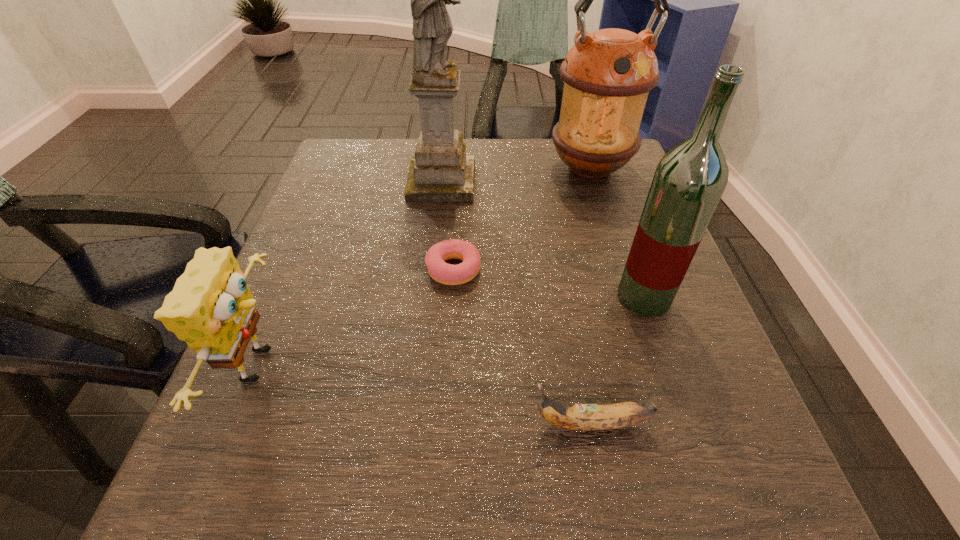
You are a GUI agent. You are given a task and a screenshot of the screen. Output one action in this format:
    pyautogui.click(x=<x>, y=<y>)
    Task: Click on the tallest object
    
    Given the screenshot: What is the action you would take?
    pyautogui.click(x=440, y=171)

This screenshot has height=540, width=960. I want to click on oil lamp, so click(607, 74).

In order to click on liquor in this screenshot , I will do `click(689, 180)`.

Where is `the leftmost object`? Image resolution: width=960 pixels, height=540 pixels. the leftmost object is located at coordinates (210, 307).

The image size is (960, 540). I want to click on sponge, so click(210, 307).

This screenshot has height=540, width=960. In order to click on the second shortest object in this screenshot , I will do `click(583, 417)`.

Locate an element on the screen. the shortest object is located at coordinates (442, 272).

This screenshot has height=540, width=960. Identify the location of free spot located 0.350m on the front-facing side of the sculpture. (627, 183).

The height and width of the screenshot is (540, 960). I want to click on vacant space located 0.070m on the front of the oil lamp, so click(604, 212).

Image resolution: width=960 pixels, height=540 pixels. What are the coordinates of `free space located 0.110m on the back of the liquor` in the screenshot? It's located at (624, 239).